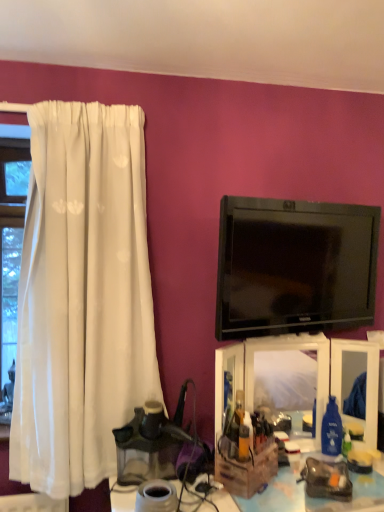
Question: Can you confirm if translucent plastic makeup organizer at center is wider than black glossy tv at upper right?

Choices:
 (A) no
 (B) yes

Answer: (B)

Question: Could you tell me if translucent plastic makeup organizer at center is turned towards black glossy tv at upper right?

Choices:
 (A) yes
 (B) no

Answer: (B)

Question: Is translucent plastic makeup organizer at center far away from black glossy tv at upper right?

Choices:
 (A) yes
 (B) no

Answer: (B)

Question: Is translucent plastic makeup organizer at center smaller than black glossy tv at upper right?

Choices:
 (A) yes
 (B) no

Answer: (B)

Question: From a real-world perspective, does translucent plastic makeup organizer at center sit lower than black glossy tv at upper right?

Choices:
 (A) no
 (B) yes

Answer: (B)

Question: From a real-world perspective, relative to black glossy tv at upper right, is translucent plastic makeup organizer at center vertically above or below?

Choices:
 (A) above
 (B) below

Answer: (B)

Question: Does point (215, 389) appear closer or farther from the camera than point (355, 239)?

Choices:
 (A) farther
 (B) closer

Answer: (B)

Question: Relative to black glossy tv at upper right, is translucent plastic makeup organizer at center in front or behind?

Choices:
 (A) behind
 (B) front

Answer: (A)

Question: In terms of height, does translucent plastic makeup organizer at center look taller or shorter compared to black glossy tv at upper right?

Choices:
 (A) tall
 (B) short

Answer: (B)

Question: Is translucent plastic makeup organizer at center bigger or smaller than wooden crate at lower right?

Choices:
 (A) big
 (B) small

Answer: (B)

Question: Choose the correct answer: Is translucent plastic makeup organizer at center inside wooden crate at lower right or outside it?

Choices:
 (A) inside
 (B) outside

Answer: (B)

Question: Considering the positions of translucent plastic makeup organizer at center and wooden crate at lower right in the image, is translucent plastic makeup organizer at center taller or shorter than wooden crate at lower right?

Choices:
 (A) short
 (B) tall

Answer: (B)

Question: From the image's perspective, is translucent plastic makeup organizer at center positioned above or below wooden crate at lower right?

Choices:
 (A) below
 (B) above

Answer: (B)

Question: Is wooden crate at lower right bigger or smaller than black glossy tv at upper right?

Choices:
 (A) small
 (B) big

Answer: (B)

Question: In terms of width, does wooden crate at lower right look wider or thinner when compared to black glossy tv at upper right?

Choices:
 (A) wide
 (B) thin

Answer: (A)